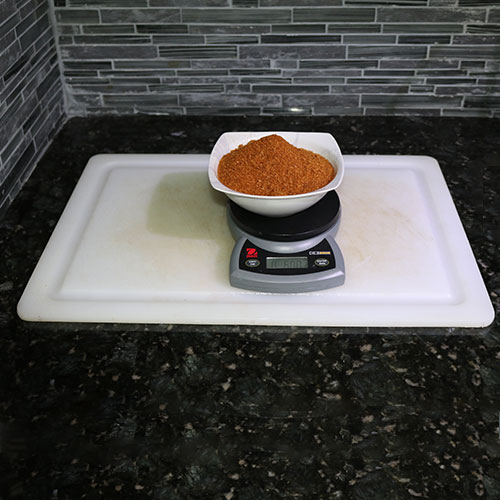
Where is `kitchen tiled wall`? kitchen tiled wall is located at coordinates (384, 54), (51, 59).